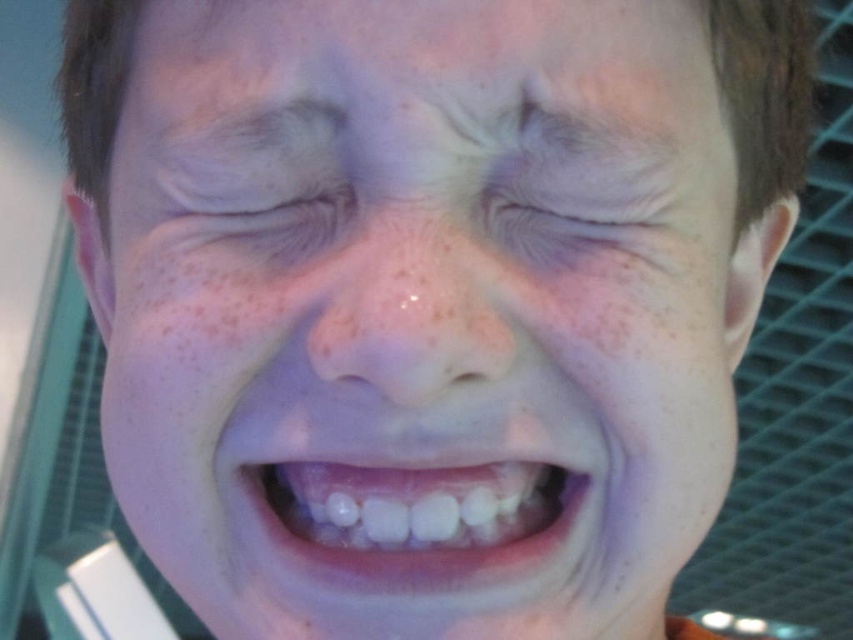
You are a photographer adjusting your camera focus. You notice the pink matte nose at center and the dry skin at center in your viewfinder. Which object should you focus on to ensure the closest subject is sharp?

The pink matte nose at center is closer to the viewer than the dry skin at center, so you should focus on the pink matte nose at center to ensure the closest subject is sharp.

You are a photographer adjusting your camera to focus on two points in the image of a smiling face. The points are labeled as point (370, 372) and point (260, 257). Which point should you focus on first if you want to ensure the closest object is sharp?

Point (370, 372) is closer to the viewer than point (260, 257), so you should focus on point (370, 372) first to ensure the closest object is sharp.

You are a photographer using a camera with a 10 inch lens. You want to take a portrait of the person in the scene. If the pink matte nose at center is the main focus, will the lens be close enough to capture it without being too intrusive?

The pink matte nose at center and viewer are 8.34 inches apart. Since the photographer is using a 10 inch lens, the lens can be positioned close enough to capture the pink matte nose at center while maintaining a comfortable distance, avoiding intrusiveness.